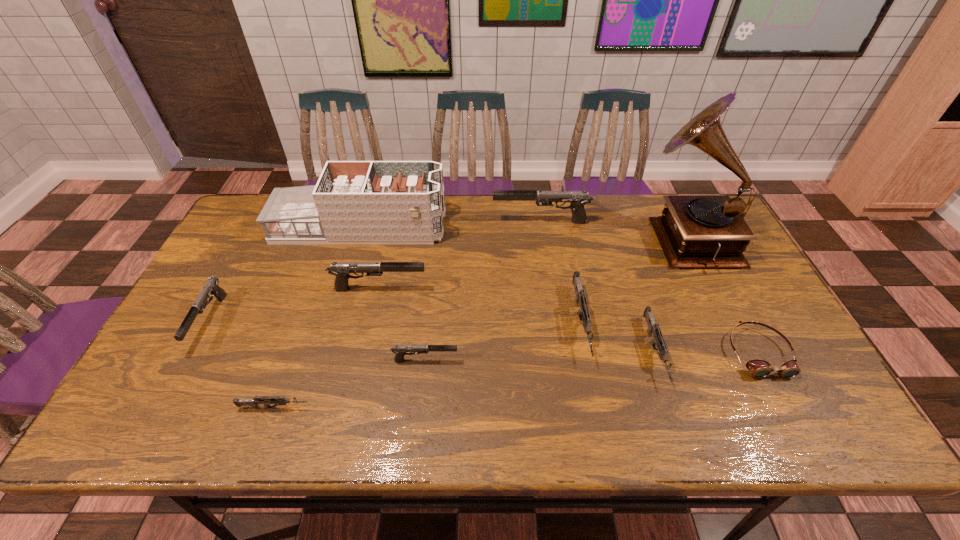
Locate an element on the screen. The width and height of the screenshot is (960, 540). brown record player is located at coordinates (694, 231).

Identify the location of record player. (x=694, y=231).

Where is `the second tallest object`? Image resolution: width=960 pixels, height=540 pixels. the second tallest object is located at coordinates (362, 202).

At what (x,y) coordinates should I click in order to perform the action: click on the biggest gray gun. Please return your answer as a coordinate pair (x, y). Image resolution: width=960 pixels, height=540 pixels. Looking at the image, I should click on (578, 199).

Where is `the farthest gun`? This screenshot has width=960, height=540. the farthest gun is located at coordinates coord(578,199).

I want to click on the fourth tallest object, so click(342, 270).

At what (x,y) coordinates should I click in order to perform the action: click on the second tallest gun. Please return your answer as a coordinate pair (x, y). The image size is (960, 540). Looking at the image, I should click on (342, 270).

Where is `the second grey gun from right to left`? The image size is (960, 540). the second grey gun from right to left is located at coordinates (583, 313).

Where is `the second smallest gray gun`? The height and width of the screenshot is (540, 960). the second smallest gray gun is located at coordinates (211, 286).

This screenshot has width=960, height=540. I want to click on the leftmost gray gun, so click(x=211, y=286).